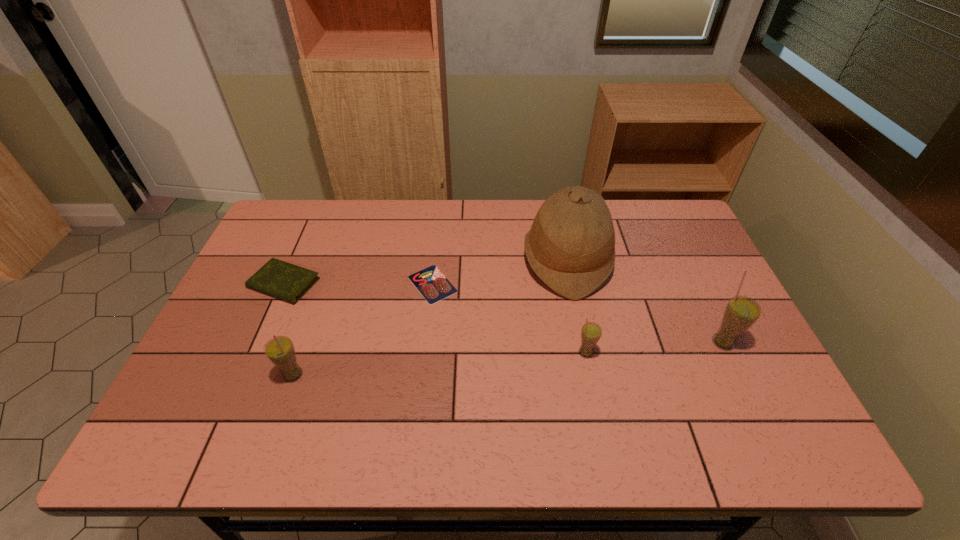
What are the coordinates of `object that is at the left edge` in the screenshot? It's located at (277, 278).

Find the location of a particular element. The image size is (960, 540). object that is at the right edge is located at coordinates (741, 312).

Identify the location of vacant space at the far edge. (424, 238).

What are the coordinates of `vacant space at the near edge of the desktop` in the screenshot? It's located at (542, 387).

The image size is (960, 540). Identify the location of vacant region at the left edge of the desktop. (261, 330).

Identify the location of vacant area at the right edge. The width and height of the screenshot is (960, 540). (692, 307).

In order to click on free point at the far right corner in this screenshot , I will do `click(669, 200)`.

Where is `vacant space that's between the fourth shortest object and the third shortest object`? vacant space that's between the fourth shortest object and the third shortest object is located at coordinates (440, 363).

Where is `free spot between the tallest straw for drinking and the hat`? free spot between the tallest straw for drinking and the hat is located at coordinates (645, 301).

Where is `empty location between the diary and the rightmost object`? empty location between the diary and the rightmost object is located at coordinates (504, 313).